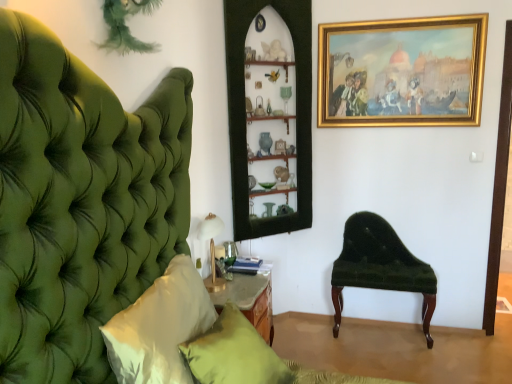
Question: Would you consider white satin pillow at left, the 1th pillow viewed from the front, to be distant from gold metallic table lamp at lower left?

Choices:
 (A) yes
 (B) no

Answer: (B)

Question: Is white satin pillow at left, the 1th pillow viewed from the front, facing away from gold metallic table lamp at lower left?

Choices:
 (A) no
 (B) yes

Answer: (A)

Question: From a real-world perspective, is white satin pillow at left, which is the second pillow from back to front, physically below gold metallic table lamp at lower left?

Choices:
 (A) no
 (B) yes

Answer: (B)

Question: Does white satin pillow at left, which is the second pillow from back to front, have a larger size compared to gold metallic table lamp at lower left?

Choices:
 (A) yes
 (B) no

Answer: (A)

Question: Is white satin pillow at left, which is the second pillow from back to front, positioned beyond the bounds of gold metallic table lamp at lower left?

Choices:
 (A) yes
 (B) no

Answer: (A)

Question: Does point tap(151, 336) appear closer or farther from the camera than point tap(338, 39)?

Choices:
 (A) farther
 (B) closer

Answer: (B)

Question: Is white satin pillow at left, the 1th pillow viewed from the front, inside or outside of gold/gilded picture frame at upper right?

Choices:
 (A) outside
 (B) inside

Answer: (A)

Question: Is white satin pillow at left, the 1th pillow viewed from the front, wider or thinner than gold/gilded picture frame at upper right?

Choices:
 (A) wide
 (B) thin

Answer: (A)

Question: From their relative heights in the image, would you say white satin pillow at left, the 1th pillow viewed from the front, is taller or shorter than gold/gilded picture frame at upper right?

Choices:
 (A) tall
 (B) short

Answer: (A)

Question: Considering the positions of velvet green bench at right and gold/gilded picture frame at upper right in the image, is velvet green bench at right wider or thinner than gold/gilded picture frame at upper right?

Choices:
 (A) wide
 (B) thin

Answer: (A)

Question: Relative to gold/gilded picture frame at upper right, is velvet green bench at right in front or behind?

Choices:
 (A) front
 (B) behind

Answer: (B)

Question: Is velvet green bench at right bigger or smaller than gold/gilded picture frame at upper right?

Choices:
 (A) small
 (B) big

Answer: (B)

Question: From a real-world perspective, is velvet green bench at right above or below gold/gilded picture frame at upper right?

Choices:
 (A) above
 (B) below

Answer: (B)

Question: From the image's perspective, is velvet green bench at right located above or below matte green pillow at lower center, which appears as the first pillow when viewed from the back?

Choices:
 (A) above
 (B) below

Answer: (A)

Question: Is velvet green bench at right spatially inside matte green pillow at lower center, which appears as the first pillow when viewed from the back, or outside of it?

Choices:
 (A) outside
 (B) inside

Answer: (A)